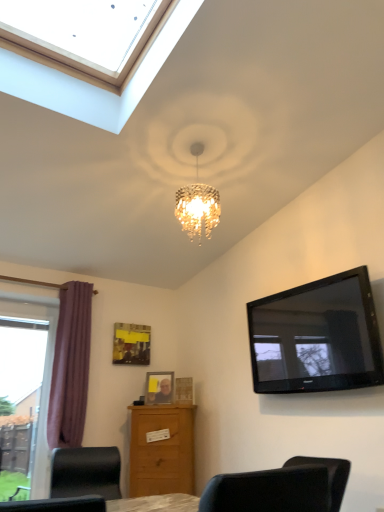
Question: Considering the positions of wooden chest of drawers at lower center and transparent glass window at left in the image, is wooden chest of drawers at lower center taller or shorter than transparent glass window at left?

Choices:
 (A) tall
 (B) short

Answer: (B)

Question: Is wooden chest of drawers at lower center in front of or behind transparent glass window at left in the image?

Choices:
 (A) front
 (B) behind

Answer: (B)

Question: Which of these objects is positioned closest to the matte plastic picture frame at center, the second picture frame when ordered from left to right?

Choices:
 (A) transparent glass window at left
 (B) black glossy tv at upper right
 (C) wooden chest of drawers at lower center
 (D) purple fabric curtain at left
 (E) black leather chair at lower left

Answer: (C)

Question: Based on their relative distances, which object is farther from the wooden chest of drawers at lower center?

Choices:
 (A) transparent glass window at left
 (B) matte yellow paper at upper center, the 3th picture frame from the right
 (C) purple fabric curtain at left
 (D) matte plastic picture frame at center, the 2th picture frame viewed from the right
 (E) black glossy tv at upper right

Answer: (E)